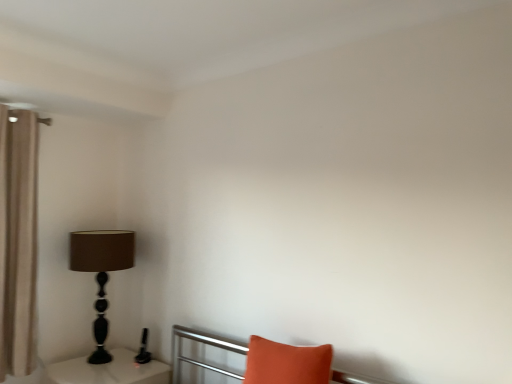
Question: From the image's perspective, would you say orange fabric pillow at lower right is shown under matte black lamp at left?

Choices:
 (A) yes
 (B) no

Answer: (A)

Question: Are orange fabric pillow at lower right and matte black lamp at left making contact?

Choices:
 (A) yes
 (B) no

Answer: (B)

Question: Is orange fabric pillow at lower right outside matte black lamp at left?

Choices:
 (A) yes
 (B) no

Answer: (A)

Question: Can you confirm if orange fabric pillow at lower right is shorter than matte black lamp at left?

Choices:
 (A) no
 (B) yes

Answer: (B)

Question: From a real-world perspective, is orange fabric pillow at lower right located beneath matte black lamp at left?

Choices:
 (A) no
 (B) yes

Answer: (B)

Question: Is orange fabric pillow at lower right far away from matte black lamp at left?

Choices:
 (A) no
 (B) yes

Answer: (B)

Question: Does matte black lamp at left appear on the left side of beige fabric curtain at left?

Choices:
 (A) no
 (B) yes

Answer: (A)

Question: Is matte black lamp at left further to camera compared to beige fabric curtain at left?

Choices:
 (A) yes
 (B) no

Answer: (A)

Question: Does matte black lamp at left have a larger size compared to beige fabric curtain at left?

Choices:
 (A) yes
 (B) no

Answer: (A)

Question: Does matte black lamp at left turn towards beige fabric curtain at left?

Choices:
 (A) no
 (B) yes

Answer: (B)

Question: Is matte black lamp at left thinner than beige fabric curtain at left?

Choices:
 (A) yes
 (B) no

Answer: (B)

Question: From the image's perspective, is matte black lamp at left under beige fabric curtain at left?

Choices:
 (A) no
 (B) yes

Answer: (B)

Question: Does beige fabric curtain at left have a greater width compared to white glossy table at lower left?

Choices:
 (A) yes
 (B) no

Answer: (B)